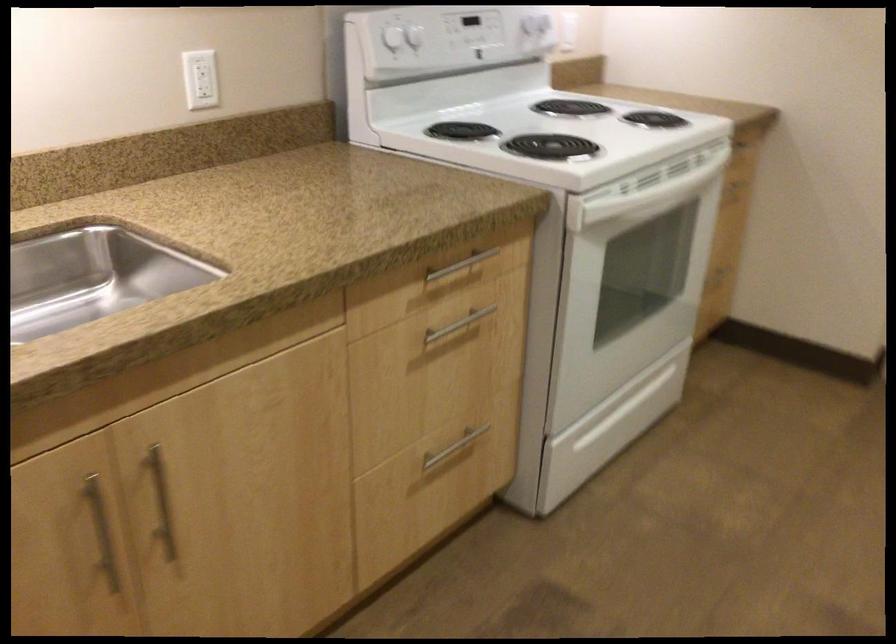
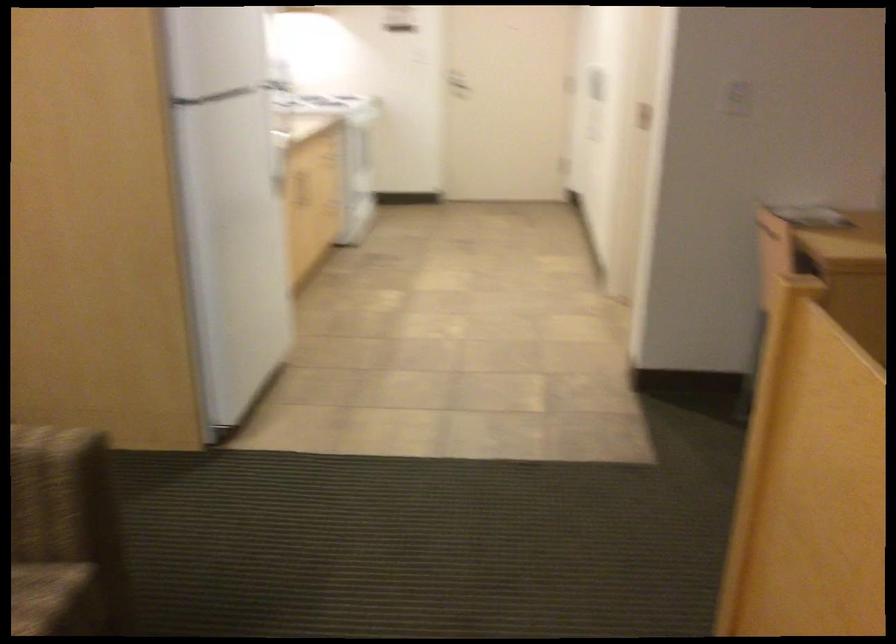
Question: I am providing you with two images of the same scene from different viewpoints. After the viewpoint changes to image2, which objects are now occluded?

Choices:
 (A) door handle
 (B) white light switch
 (C) wooden cabinet handle
 (D) floral pattern pillow

Answer: (B)